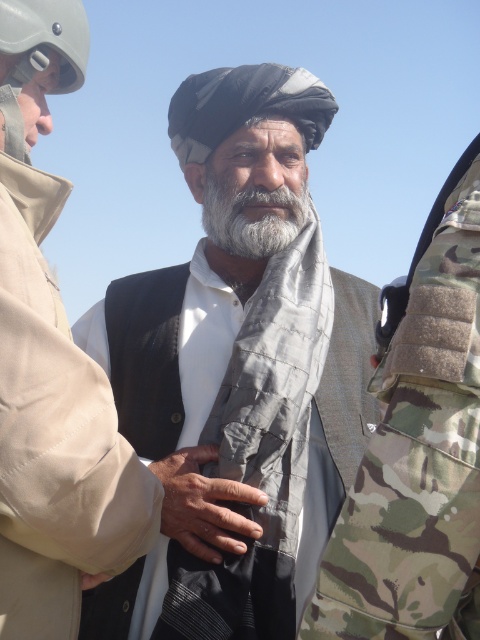
How far apart are gray quilted scarf at center and dry skin at center?

They are 8.13 inches apart.

Where is `gray quilted scarf at center`? The image size is (480, 640). gray quilted scarf at center is located at coordinates (239, 358).

Where is `gray quilted scarf at center`? gray quilted scarf at center is located at coordinates (239, 358).

Based on the photo, who is positioned more to the left, white matte scarf at center or white soft beard at center?

From the viewer's perspective, white matte scarf at center appears more on the left side.

Does white matte scarf at center have a smaller size compared to white soft beard at center?

Actually, white matte scarf at center might be larger than white soft beard at center.

What do you see at coordinates (52, 372) in the screenshot? I see `white matte scarf at center` at bounding box center [52, 372].

Where is `white matte scarf at center`? This screenshot has width=480, height=640. white matte scarf at center is located at coordinates (52, 372).

Who is more forward, (247, 627) or (238, 202)?

Point (247, 627) is in front.

Is point (316, 547) in front of point (229, 195)?

That is True.

Where is `gray quilted scarf at center`? This screenshot has height=640, width=480. gray quilted scarf at center is located at coordinates (239, 358).

Find the location of a particular element. gray quilted scarf at center is located at coordinates (239, 358).